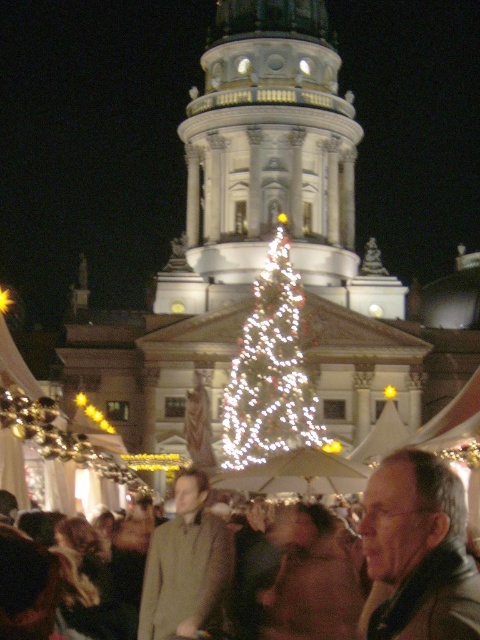
Can you confirm if illuminated glass christmas tree at center is wider than green wool coat at center?

Correct, the width of illuminated glass christmas tree at center exceeds that of green wool coat at center.

Image resolution: width=480 pixels, height=640 pixels. What do you see at coordinates (271, 371) in the screenshot?
I see `illuminated glass christmas tree at center` at bounding box center [271, 371].

At what (x,y) coordinates should I click in order to perform the action: click on illuminated glass christmas tree at center. Please return your answer as a coordinate pair (x, y). The width and height of the screenshot is (480, 640). Looking at the image, I should click on (271, 371).

Based on the photo, is white marble tower at center taller than brown wool coat at lower center?

Indeed, white marble tower at center has a greater height compared to brown wool coat at lower center.

Does point (347, 180) lie in front of point (467, 611)?

No, (347, 180) is behind (467, 611).

What are the coordinates of `white marble tower at center` in the screenshot? It's located at (272, 164).

Between brown wool coat at lower center and light brown leather jacket at lower right, which one is positioned higher?

brown wool coat at lower center is higher up.

Consider the image. Who is shorter, brown wool coat at lower center or light brown leather jacket at lower right?

Standing shorter between the two is light brown leather jacket at lower right.

Is point (190, 632) closer to camera compared to point (425, 548)?

No, (190, 632) is behind (425, 548).

This screenshot has height=640, width=480. In order to click on brown wool coat at lower center in this screenshot , I will do `click(419, 550)`.